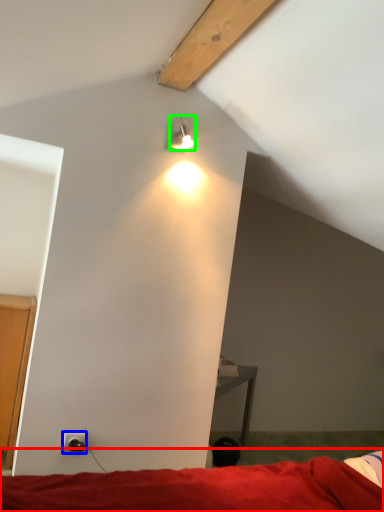
Question: Estimate the real-world distances between objects in this image. Which object is farther from bed (highlighted by a red box), power outlet (highlighted by a blue box) or lamp (highlighted by a green box)?

Choices:
 (A) power outlet
 (B) lamp

Answer: (B)